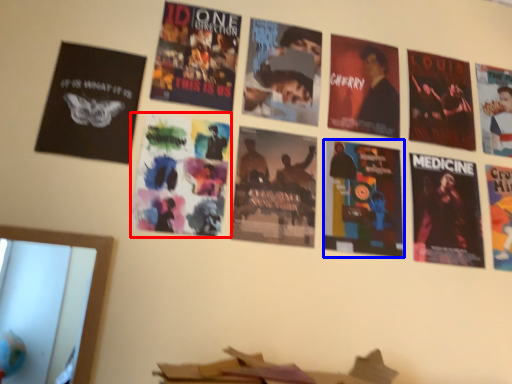
Question: Which object appears closest to the camera in this image, poster (highlighted by a red box) or poster (highlighted by a blue box)?

Choices:
 (A) poster
 (B) poster

Answer: (A)